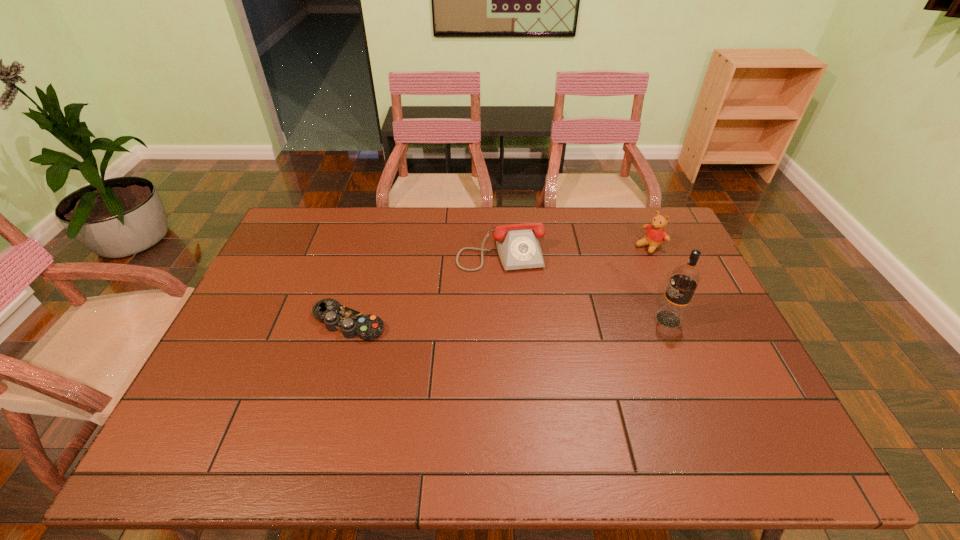
The width and height of the screenshot is (960, 540). I want to click on free space that satisfies the following two spatial constraints: 1. on the back side of the control; 2. on the label of the tallest object, so point(349,319).